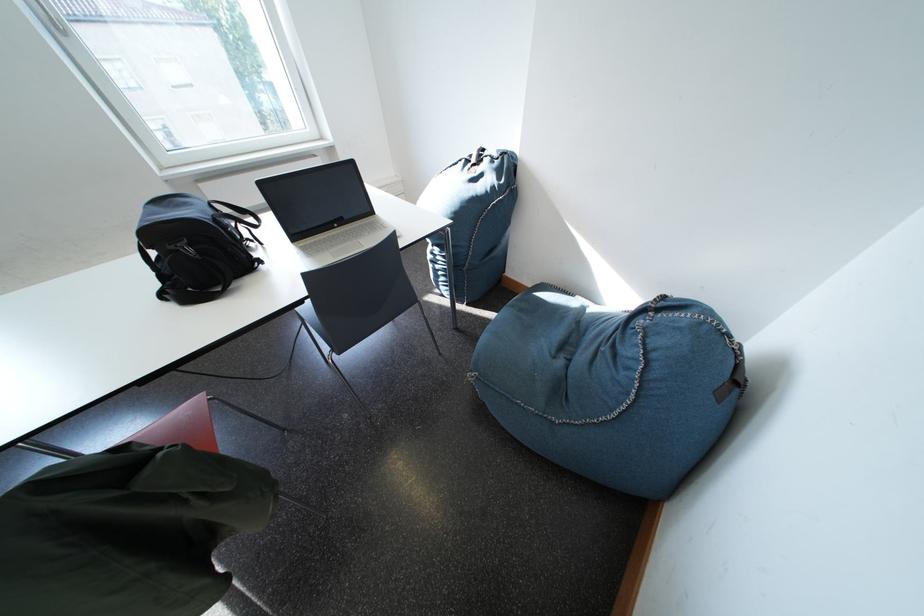
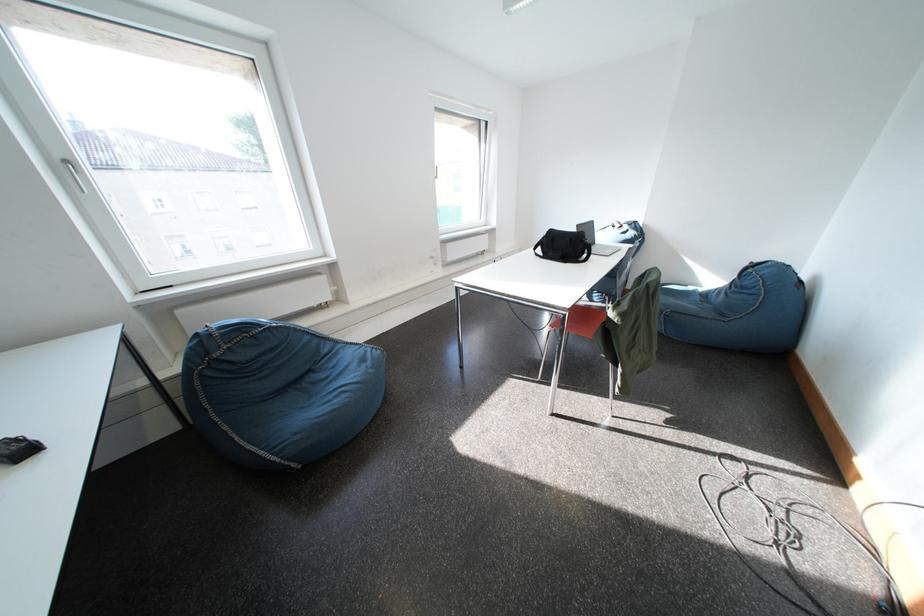
Locate, in the second image, the point that corresponds to point (481, 160) in the first image.

(624, 228)